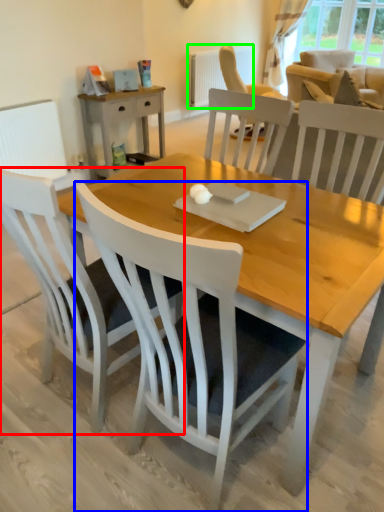
Question: Which is farther away from chair (highlighted by a red box)? chair (highlighted by a blue box) or radiator (highlighted by a green box)?

Choices:
 (A) chair
 (B) radiator

Answer: (B)